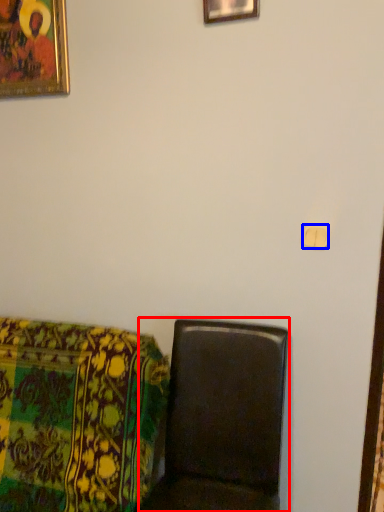
Question: Which of the following is the closest to the observer, furniture (highlighted by a red box) or light switch (highlighted by a blue box)?

Choices:
 (A) furniture
 (B) light switch

Answer: (A)